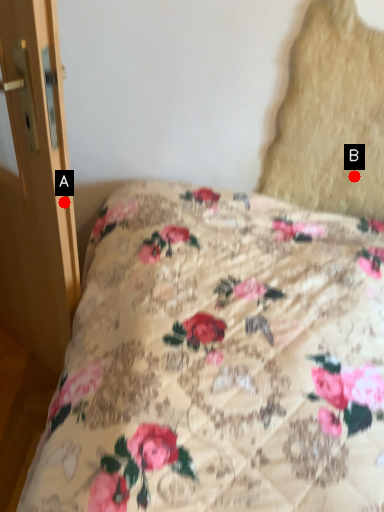
Question: Two points are circled on the image, labeled by A and B beside each circle. Which point is further to the camera?

Choices:
 (A) A is further
 (B) B is further

Answer: (B)